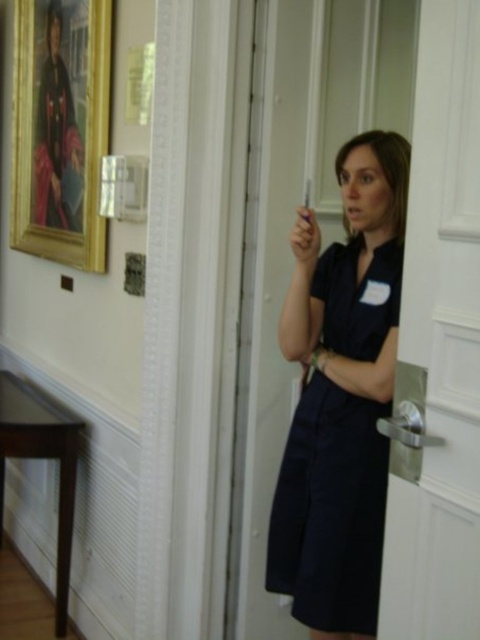
Question: Which is farther from the matte black portrait at upper left?

Choices:
 (A) gold-framed portrait at upper left
 (B) white glossy door at center
 (C) matte plastic cigarette at center

Answer: (B)

Question: Does navy blue fabric dress at center have a smaller size compared to matte plastic cigarette at center?

Choices:
 (A) yes
 (B) no

Answer: (B)

Question: Which object is the farthest from the white glossy door at center?

Choices:
 (A) gold-framed portrait at upper left
 (B) matte black portrait at upper left
 (C) matte plastic cigarette at center
 (D) navy blue fabric dress at center

Answer: (B)

Question: Does white glossy door at center appear over navy blue fabric dress at center?

Choices:
 (A) no
 (B) yes

Answer: (B)

Question: Among these objects, which one is farthest from the camera?

Choices:
 (A) matte black portrait at upper left
 (B) matte plastic cigarette at center

Answer: (A)

Question: Can you confirm if white glossy door at center is positioned to the left of matte plastic cigarette at center?

Choices:
 (A) no
 (B) yes

Answer: (A)